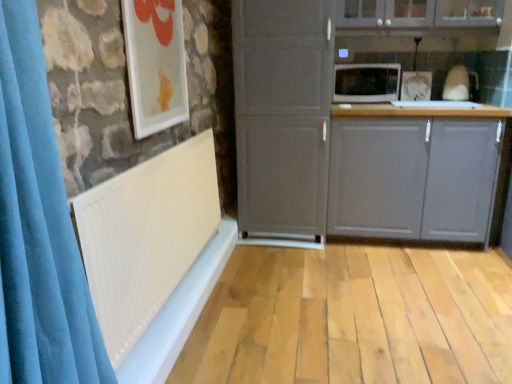
Question: Is matte gray cabinet at center, which is the second cabinetry from top to bottom, thinner than white glossy picture frame at upper left?

Choices:
 (A) yes
 (B) no

Answer: (B)

Question: From a real-world perspective, is matte gray cabinet at center, positioned as the 1th cabinetry in bottom-to-top order, located higher than white glossy picture frame at upper left?

Choices:
 (A) no
 (B) yes

Answer: (A)

Question: Is matte gray cabinet at center, positioned as the 1th cabinetry in bottom-to-top order, taller than white glossy picture frame at upper left?

Choices:
 (A) no
 (B) yes

Answer: (B)

Question: Is the position of matte gray cabinet at center, which is the second cabinetry from top to bottom, more distant than that of white glossy picture frame at upper left?

Choices:
 (A) no
 (B) yes

Answer: (B)

Question: From the image's perspective, is matte gray cabinet at center, positioned as the 1th cabinetry in bottom-to-top order, under white glossy picture frame at upper left?

Choices:
 (A) no
 (B) yes

Answer: (B)

Question: From the image's perspective, is matte gray cabinet at upper center, marked as the 2th cabinetry in a bottom-to-top arrangement, above or below white matte radiator at left?

Choices:
 (A) below
 (B) above

Answer: (B)

Question: Do you think matte gray cabinet at upper center, placed as the first cabinetry when sorted from top to bottom, is within white matte radiator at left, or outside of it?

Choices:
 (A) outside
 (B) inside

Answer: (A)

Question: In terms of width, does matte gray cabinet at upper center, placed as the first cabinetry when sorted from top to bottom, look wider or thinner when compared to white matte radiator at left?

Choices:
 (A) wide
 (B) thin

Answer: (A)

Question: Considering the relative positions of matte gray cabinet at upper center, marked as the 2th cabinetry in a bottom-to-top arrangement, and white matte radiator at left in the image provided, is matte gray cabinet at upper center, marked as the 2th cabinetry in a bottom-to-top arrangement, to the left or to the right of white matte radiator at left?

Choices:
 (A) left
 (B) right

Answer: (B)

Question: Is white glossy picture frame at upper left taller or shorter than matte gray cabinet at center, which is the second cabinetry from top to bottom?

Choices:
 (A) short
 (B) tall

Answer: (A)

Question: From the image's perspective, relative to matte gray cabinet at center, positioned as the 1th cabinetry in bottom-to-top order, is white glossy picture frame at upper left above or below?

Choices:
 (A) above
 (B) below

Answer: (A)

Question: Is white glossy picture frame at upper left to the left or to the right of matte gray cabinet at center, positioned as the 1th cabinetry in bottom-to-top order, in the image?

Choices:
 (A) right
 (B) left

Answer: (B)

Question: Choose the correct answer: Is white glossy picture frame at upper left inside matte gray cabinet at center, positioned as the 1th cabinetry in bottom-to-top order, or outside it?

Choices:
 (A) outside
 (B) inside

Answer: (A)

Question: From their relative heights in the image, would you say white glossy picture frame at upper left is taller or shorter than white matte radiator at left?

Choices:
 (A) short
 (B) tall

Answer: (A)

Question: Is white glossy picture frame at upper left wider or thinner than white matte radiator at left?

Choices:
 (A) thin
 (B) wide

Answer: (A)